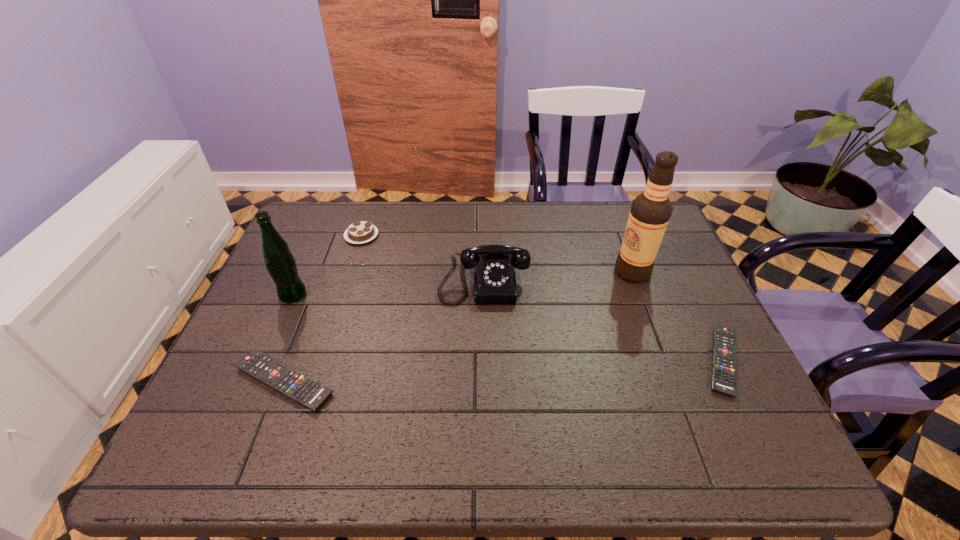
This screenshot has height=540, width=960. Find the location of `alcohol`. alcohol is located at coordinates (650, 212).

The image size is (960, 540). What are the coordinates of `vacant area located 0.310m on the right of the taller remote control` in the screenshot? It's located at (476, 381).

Where is `vacant area located 0.180m on the back of the rightmost object`? This screenshot has width=960, height=540. vacant area located 0.180m on the back of the rightmost object is located at coordinates (683, 279).

Find the location of `vacant space situated 0.120m on the dial of the fourth shortest object`. vacant space situated 0.120m on the dial of the fourth shortest object is located at coordinates (485, 342).

Identify the location of vacant space located on the left of the fourth tallest object. (309, 235).

Locate an element on the screen. This screenshot has height=540, width=960. blank area located 0.280m on the front of the beer bottle is located at coordinates (248, 399).

I want to click on vacant space located on the label of the tallest object, so click(480, 272).

At what (x,y) coordinates should I click in order to perform the action: click on free space located 0.210m on the label of the tallest object. Please return your answer as a coordinate pair (x, y). This screenshot has width=960, height=540. Looking at the image, I should click on click(540, 272).

Identify the location of free space located on the label of the tallest object. [564, 272].

At what (x,y) coordinates should I click in order to perform the action: click on object that is at the far edge. Please return your answer as a coordinate pair (x, y). Looking at the image, I should click on (358, 232).